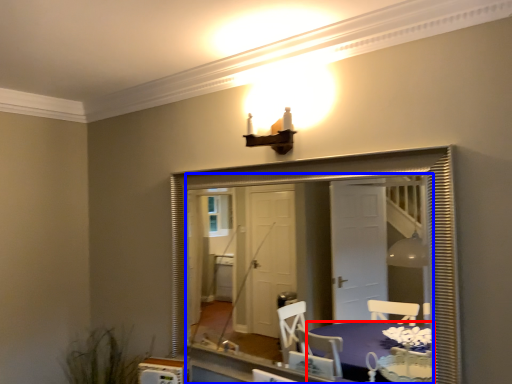
Question: Which object is closer to the camera taking this photo, table (highlighted by a red box) or mirror (highlighted by a blue box)?

Choices:
 (A) table
 (B) mirror

Answer: (A)